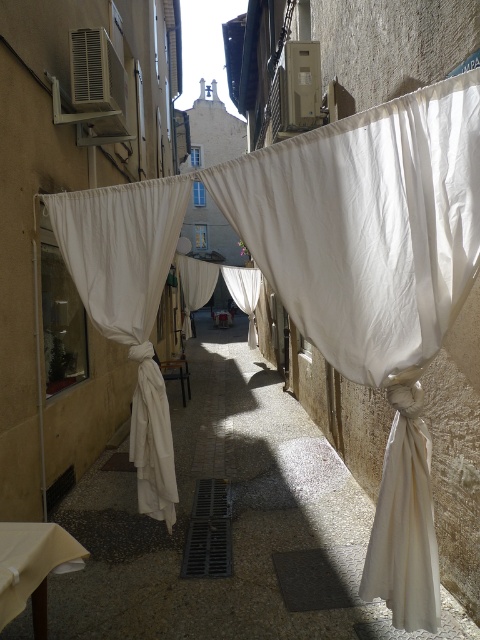
You are a painter standing in the narrow alleyway between two buildings. You want to paint both the white fabric at center and the white sheer curtain at center. Since you can only paint one at a time, which one should you paint first if you want to finish the closer one first?

The white fabric at center is closer to you than the white sheer curtain at center, so you should paint the white fabric at center first.

You are a painter setting up an easel in the alleyway. You want to capture the contrast between the two white fabrics overhead. Which of the two, the white fabric at center or the white sheer curtain at center, is lower and closer to your head?

The white fabric at center is shorter than the white sheer curtain at center, so it is lower and closer to your head.